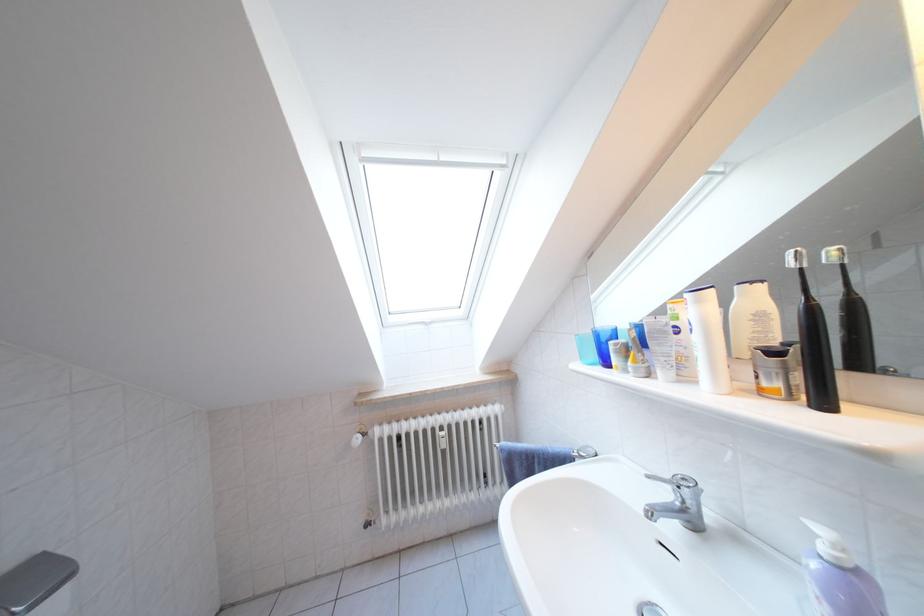
This screenshot has height=616, width=924. Find the location of `black toothbrush`. black toothbrush is located at coordinates (813, 342).